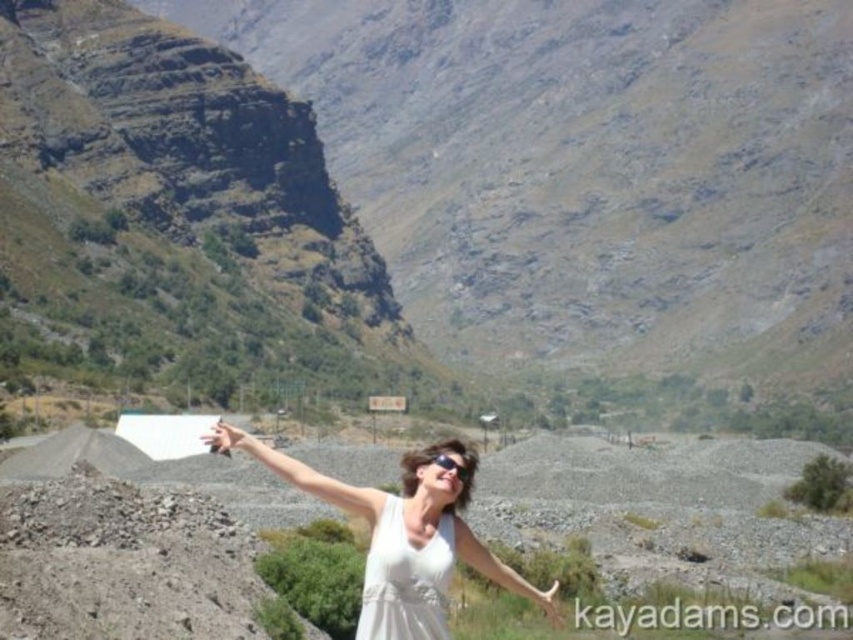
Consider the image. You are a photographer standing at the base of the brown rocky mountain at upper center. You want to take a photo that includes the entire mountain in the frame. Based on your knowledge of photography and the distance provided, can you estimate whether you need to use a wide angle lens or a telephoto lens?

The brown rocky mountain at upper center is 352.02 feet away from the camera. To capture the entire mountain in the frame from this distance, a wide angle lens would be more appropriate as it has a broader field of view, allowing you to include the entire subject when positioned at a distance.

You are a photographer taking a picture of the mountain landscape. You notice two points in the image, one at point (614, 248) and another at point (540, 595). Which point is closer to the camera?

Point (540, 595) is closer to the camera because the Objects Description states that point (614, 248) is further away than point (540, 595).

You are a photographer trying to capture the scene from the camera position. You notice two points marked in the image. Which point, point [340,506] or point [375,566], is closer to the camera?

Point [340,506] is further to the camera than point [375,566]. Therefore, point [375,566] is closer to the camera.